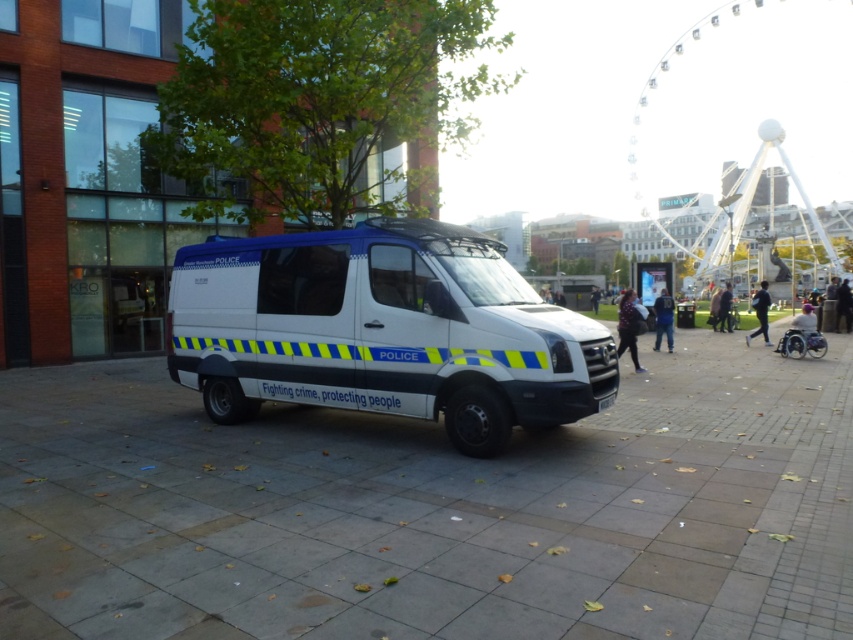
In the scene shown: Who is positioned more to the left, white paved at center or dark blue uniform at center?

Positioned to the left is white paved at center.

Can you confirm if white paved at center is wider than dark blue uniform at center?

Indeed, white paved at center has a greater width compared to dark blue uniform at center.

Image resolution: width=853 pixels, height=640 pixels. In order to click on white paved at center in this screenshot , I will do `click(432, 509)`.

At what (x,y) coordinates should I click in order to perform the action: click on white paved at center. Please return your answer as a coordinate pair (x, y). Looking at the image, I should click on (432, 509).

Is white plastic van at center to the right of dark brown leather jacket at center from the viewer's perspective?

Incorrect, white plastic van at center is not on the right side of dark brown leather jacket at center.

Between white plastic van at center and dark brown leather jacket at center, which one has less height?

With less height is dark brown leather jacket at center.

Describe the element at coordinates (381, 330) in the screenshot. I see `white plastic van at center` at that location.

In order to click on white plastic van at center in this screenshot , I will do `click(381, 330)`.

Does blue jeans at center have a lesser width compared to dark blue uniform at center?

Indeed, blue jeans at center has a lesser width compared to dark blue uniform at center.

Which is more to the left, blue jeans at center or dark blue uniform at center?

Positioned to the left is blue jeans at center.

Between point (660, 333) and point (752, 332), which one is positioned in front?

Point (660, 333) is in front.

Identify the location of blue jeans at center. The image size is (853, 640). (663, 320).